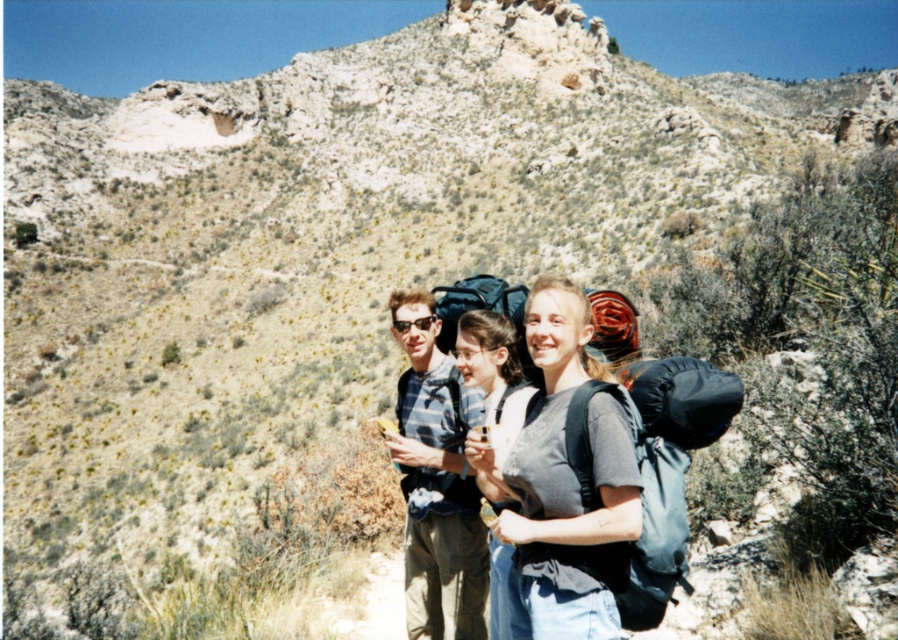
Question: Is gray fabric backpack at center positioned in front of matte gray backpack at center?

Choices:
 (A) no
 (B) yes

Answer: (B)

Question: Can you confirm if blue plaid shirt at center is thinner than matte gray backpack at center?

Choices:
 (A) yes
 (B) no

Answer: (B)

Question: Which point appears farthest from the camera in this image?

Choices:
 (A) (482, 477)
 (B) (533, 596)

Answer: (A)

Question: Observing the image, what is the correct spatial positioning of blue plaid shirt at center in reference to matte gray backpack at center?

Choices:
 (A) right
 (B) left

Answer: (B)

Question: Estimate the real-world distances between objects in this image. Which object is farther from the gray fabric backpack at center?

Choices:
 (A) matte gray backpack at center
 (B) blue plaid shirt at center

Answer: (B)

Question: Which object is closer to the camera taking this photo?

Choices:
 (A) matte gray backpack at center
 (B) blue plaid shirt at center
 (C) gray fabric backpack at center

Answer: (C)